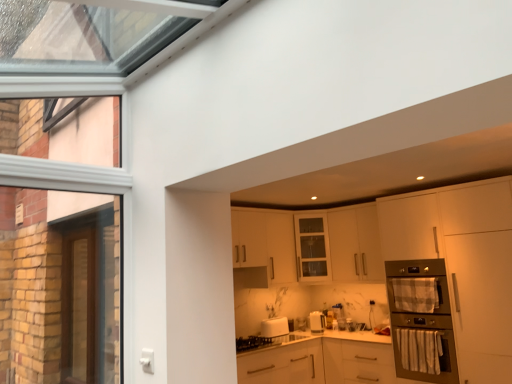
Question: Are white matte cabinet at lower center, the third cabinetry positioned from the top, and plaid fabric oven door at right far apart?

Choices:
 (A) no
 (B) yes

Answer: (A)

Question: From the image's perspective, is white matte cabinet at lower center, the 1th cabinetry positioned from the bottom, beneath plaid fabric oven door at right?

Choices:
 (A) yes
 (B) no

Answer: (A)

Question: Does white matte cabinet at lower center, the 1th cabinetry positioned from the bottom, appear on the left side of plaid fabric oven door at right?

Choices:
 (A) no
 (B) yes

Answer: (B)

Question: Considering the relative sizes of white matte cabinet at lower center, the 1th cabinetry positioned from the bottom, and plaid fabric oven door at right in the image provided, is white matte cabinet at lower center, the 1th cabinetry positioned from the bottom, bigger than plaid fabric oven door at right?

Choices:
 (A) yes
 (B) no

Answer: (A)

Question: Considering the relative sizes of white matte cabinet at lower center, the 1th cabinetry positioned from the bottom, and plaid fabric oven door at right in the image provided, is white matte cabinet at lower center, the 1th cabinetry positioned from the bottom, shorter than plaid fabric oven door at right?

Choices:
 (A) no
 (B) yes

Answer: (A)

Question: From the image's perspective, is white matte cabinet at lower center, the third cabinetry positioned from the top, above plaid fabric oven door at right?

Choices:
 (A) yes
 (B) no

Answer: (B)

Question: Is white glossy toaster at lower center located outside plaid fabric oven door at right?

Choices:
 (A) no
 (B) yes

Answer: (B)

Question: Considering the relative sizes of white glossy toaster at lower center and plaid fabric oven door at right in the image provided, is white glossy toaster at lower center shorter than plaid fabric oven door at right?

Choices:
 (A) yes
 (B) no

Answer: (A)

Question: Is white glossy toaster at lower center further to the viewer compared to plaid fabric oven door at right?

Choices:
 (A) yes
 (B) no

Answer: (A)

Question: From the image's perspective, is white glossy toaster at lower center beneath plaid fabric oven door at right?

Choices:
 (A) no
 (B) yes

Answer: (B)

Question: Is white glossy toaster at lower center to the right of plaid fabric oven door at right from the viewer's perspective?

Choices:
 (A) yes
 (B) no

Answer: (B)

Question: From a real-world perspective, is white glossy toaster at lower center located higher than plaid fabric oven door at right?

Choices:
 (A) no
 (B) yes

Answer: (A)

Question: Is metallic stainless steel oven at right further to camera compared to plaid fabric oven door at right?

Choices:
 (A) no
 (B) yes

Answer: (A)